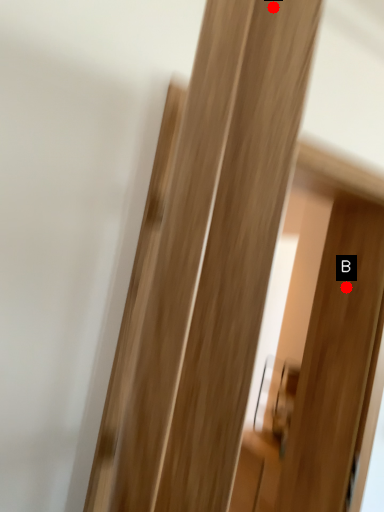
Question: Two points are circled on the image, labeled by A and B beside each circle. Among these points, which one is nearest to the camera?

Choices:
 (A) A is closer
 (B) B is closer

Answer: (A)